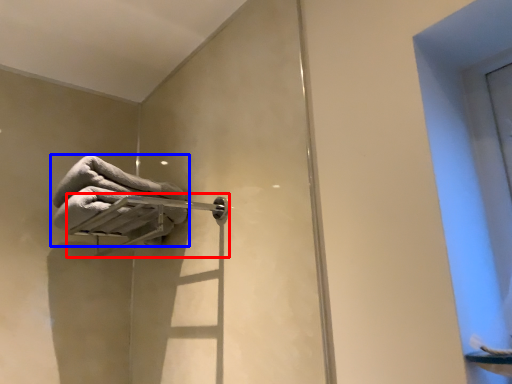
Question: Which of the following is the closest to the observer, towel bar (highlighted by a red box) or towel (highlighted by a blue box)?

Choices:
 (A) towel bar
 (B) towel

Answer: (A)